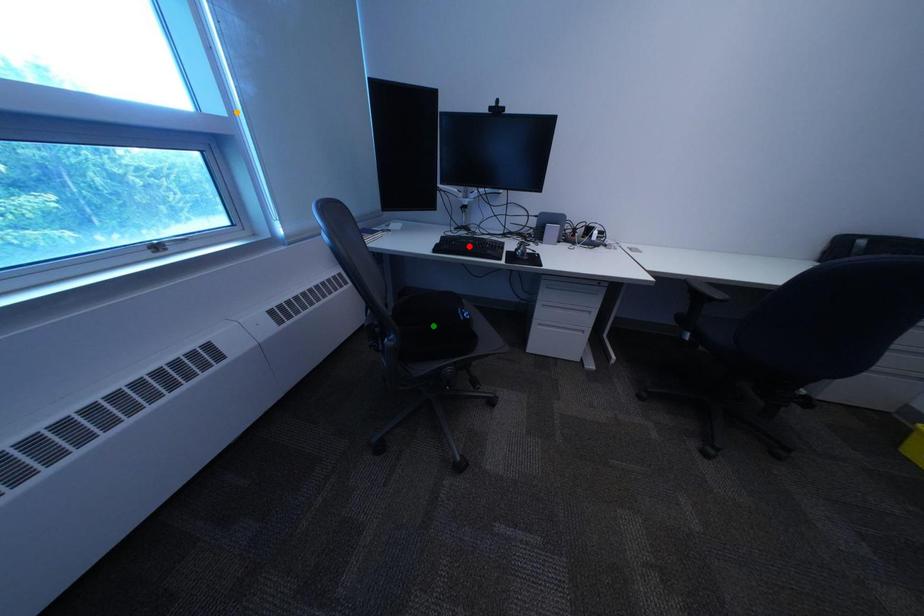
Order these from nearest to farthest:
- red point
- orange point
- green point

orange point < green point < red point